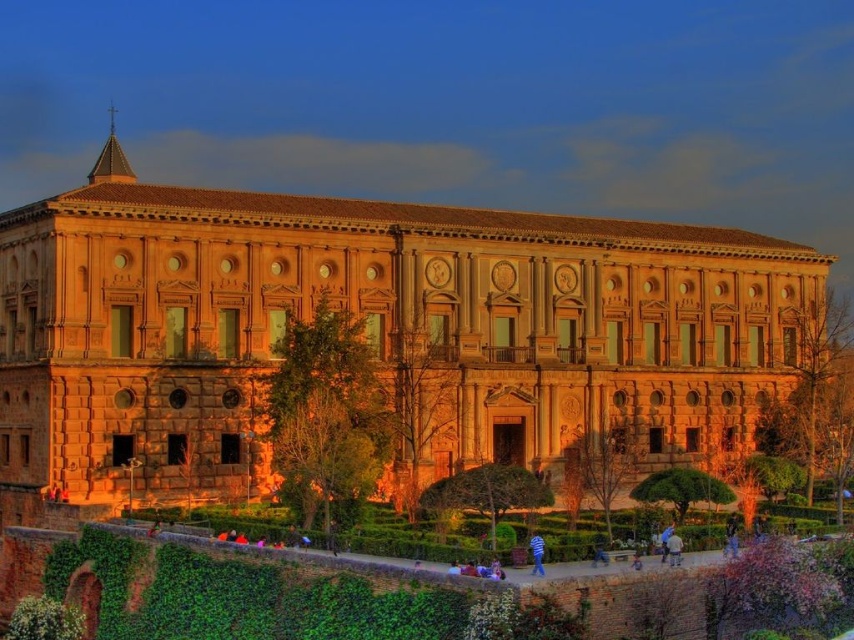
Question: Is brown stone building at center below blue striped shirt at lower center?

Choices:
 (A) no
 (B) yes

Answer: (A)

Question: Does brown stone building at center appear on the left side of blue striped shirt at lower center?

Choices:
 (A) no
 (B) yes

Answer: (B)

Question: Which point is farther to the camera?

Choices:
 (A) blue striped shirt at lower center
 (B) brown stone building at center

Answer: (B)

Question: Can you confirm if brown stone building at center is wider than blue striped shirt at lower center?

Choices:
 (A) no
 (B) yes

Answer: (B)

Question: Which point appears farthest from the camera in this image?

Choices:
 (A) (610, 282)
 (B) (533, 538)

Answer: (A)